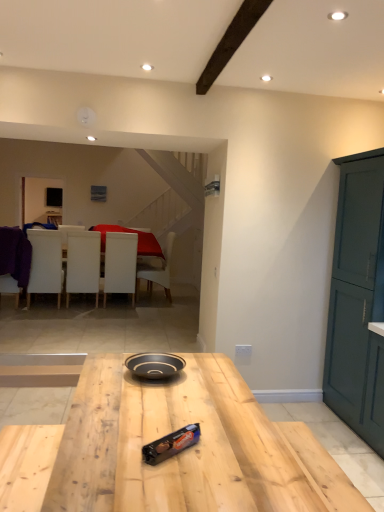
What are the coordinates of `free spot in front of shiny chocolate bar at center` in the screenshot? It's located at (178, 482).